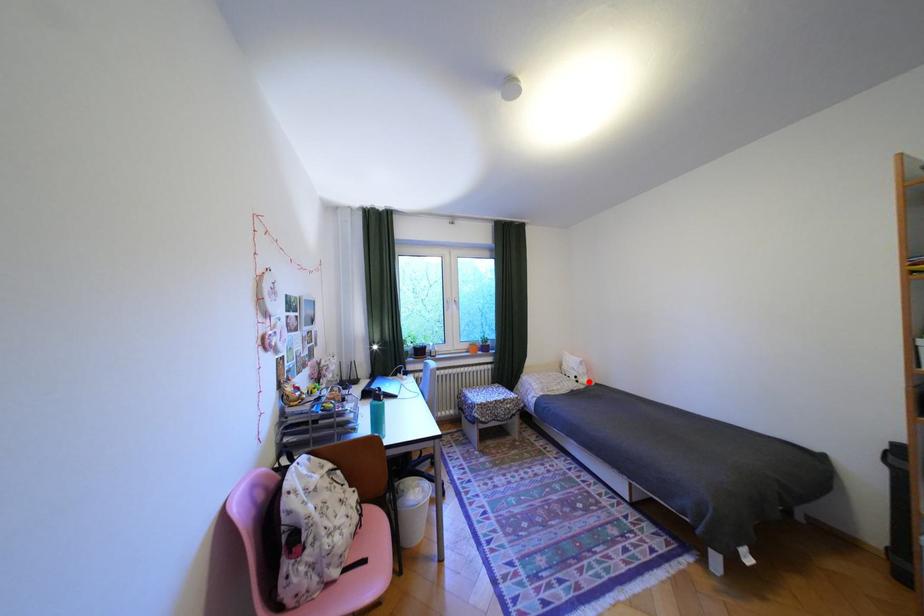
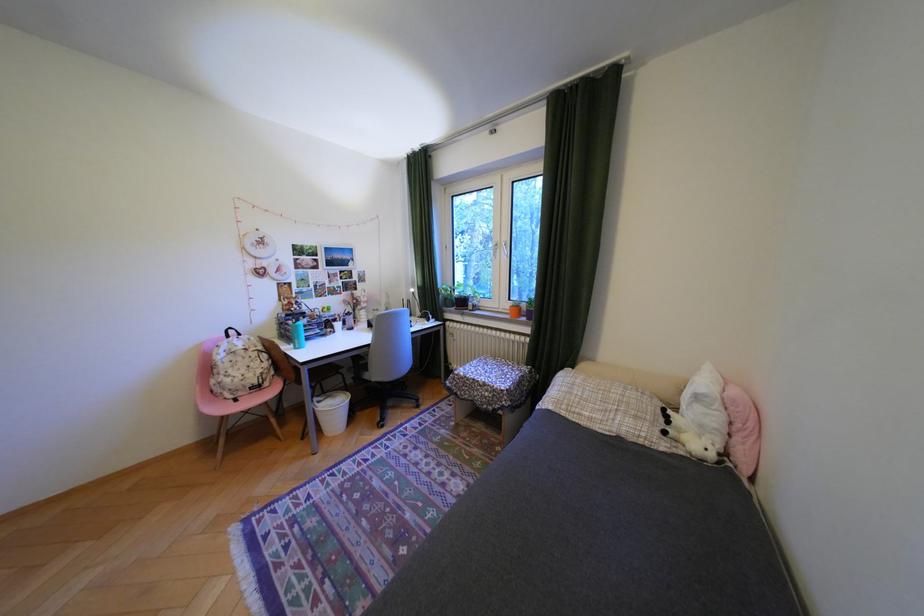
Locate, in the second image, the point that corresponds to the highlighted location in the first image.

(676, 432)